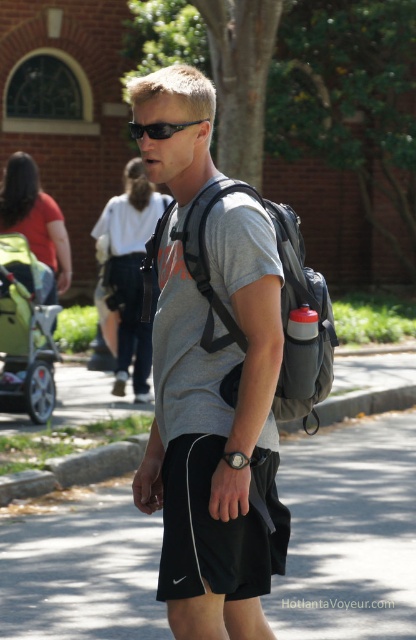
Question: Considering the real-world distances, which object is farthest from the black plastic sunglasses at center?

Choices:
 (A) green fabric stroller at left
 (B) black fabric shorts at center
 (C) black asphalt pavement at center
 (D) gray fabric backpack at center

Answer: (A)

Question: Can you confirm if black fabric shorts at center is positioned to the right of black plastic sunglasses at center?

Choices:
 (A) yes
 (B) no

Answer: (A)

Question: Estimate the real-world distances between objects in this image. Which object is farther from the black asphalt pavement at center?

Choices:
 (A) gray fabric backpack at center
 (B) black fabric shorts at center
 (C) black plastic sunglasses at center

Answer: (C)

Question: Can you confirm if black fabric shorts at center is positioned below green fabric stroller at left?

Choices:
 (A) yes
 (B) no

Answer: (A)

Question: Does gray fabric backpack at center have a smaller size compared to black plastic sunglasses at center?

Choices:
 (A) no
 (B) yes

Answer: (A)

Question: Which of the following is the farthest from the observer?

Choices:
 (A) black asphalt pavement at center
 (B) black fabric shorts at center

Answer: (A)